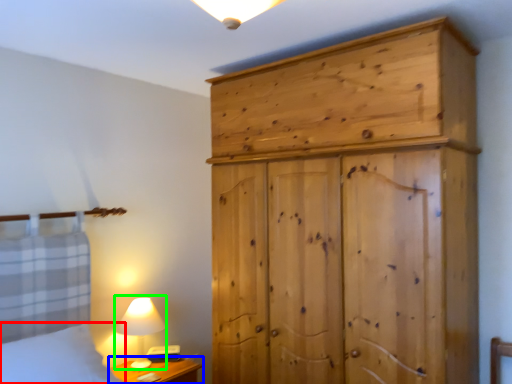
Question: Considering the real-world distances, which object is closest to bedding (highlighted by a red box)? nightstand (highlighted by a blue box) or table lamp (highlighted by a green box).

Choices:
 (A) nightstand
 (B) table lamp

Answer: (B)